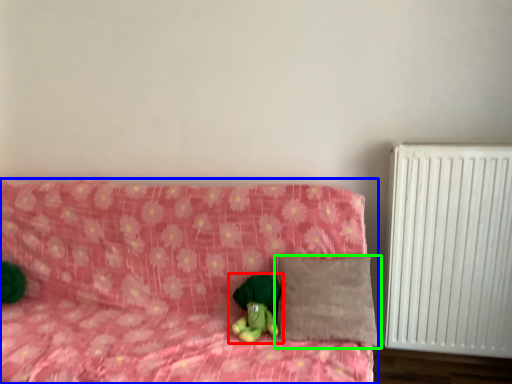
Question: Which is farther away from toy (highlighted by a red box)? furniture (highlighted by a blue box) or pillow (highlighted by a green box)?

Choices:
 (A) furniture
 (B) pillow

Answer: (A)